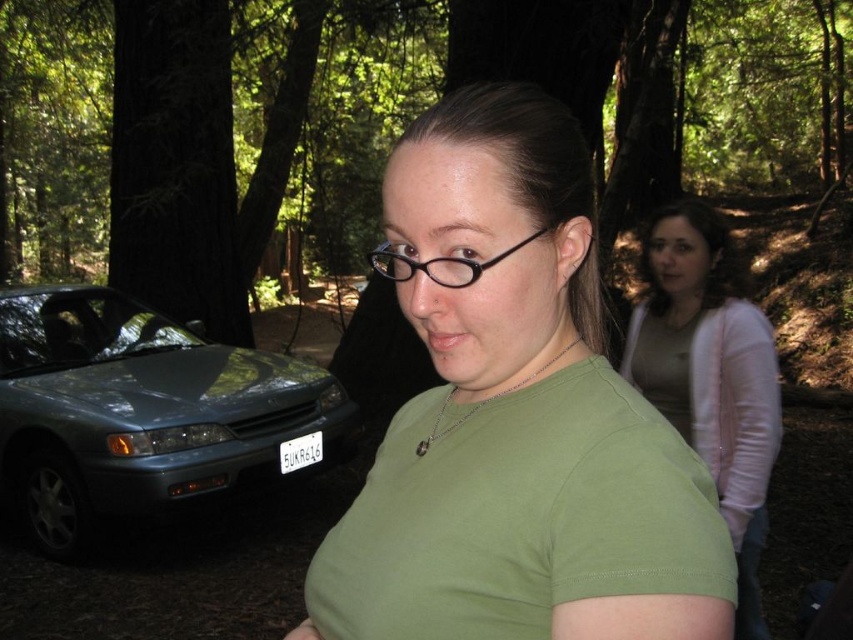
Between green matte shirt at center and metallic blue car at left, which one appears on the right side from the viewer's perspective?

Positioned to the right is green matte shirt at center.

Does point (595, 561) come in front of point (97, 499)?

That is True.

Between point (531, 362) and point (79, 550), which one is positioned behind?

Positioned behind is point (79, 550).

I want to click on green matte shirt at center, so click(515, 417).

Which is more to the right, green matte shirt at center or light pink sweater at upper right?

light pink sweater at upper right is more to the right.

Can you confirm if green matte shirt at center is bigger than light pink sweater at upper right?

No, green matte shirt at center is not bigger than light pink sweater at upper right.

Between point (560, 538) and point (729, 372), which one is positioned in front?

Point (560, 538) is in front.

Where is `green matte shirt at center`? This screenshot has width=853, height=640. green matte shirt at center is located at coordinates (515, 417).

Is metallic blue car at left to the right of black plastic glasses at center from the viewer's perspective?

In fact, metallic blue car at left is to the left of black plastic glasses at center.

Can you confirm if metallic blue car at left is positioned above black plastic glasses at center?

No.

The image size is (853, 640). What do you see at coordinates (138, 412) in the screenshot? I see `metallic blue car at left` at bounding box center [138, 412].

Locate an element on the screen. This screenshot has height=640, width=853. metallic blue car at left is located at coordinates (138, 412).